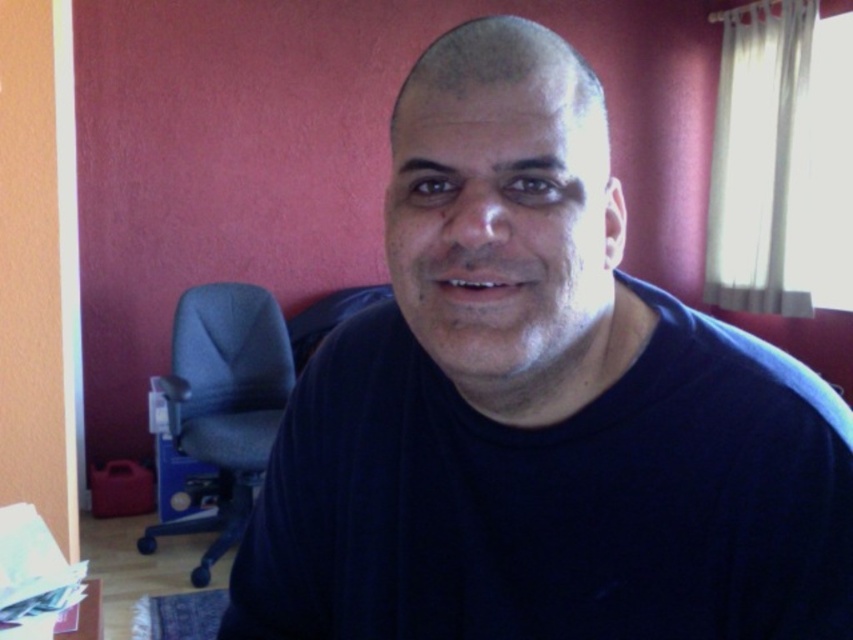
You are organizing a small party and need to place a 1.2 meter long tablecloth on the wooden table at lower left. Considering the position of the dark gray fabric chair at left, will the tablecloth extend beyond the chair?

The dark gray fabric chair at left is located above the wooden table at lower left, meaning the chair is positioned higher up relative to the table. Since the tablecloth is placed on the table, it will naturally extend beyond the chair as the chair is not obstructing the lower part of the table where the cloth is spread.